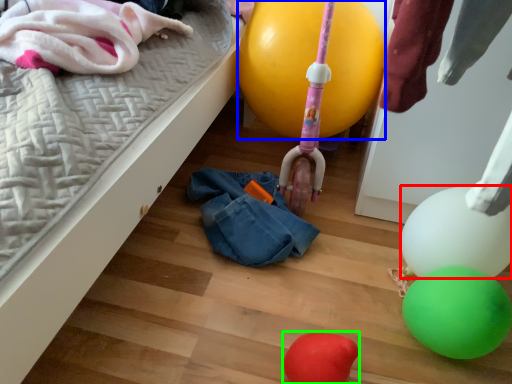
Question: Based on their relative distances, which object is farther from balloon (highlighted by a red box)? Choose from balloon (highlighted by a blue box) and balloon (highlighted by a green box).

Choices:
 (A) balloon
 (B) balloon

Answer: (A)